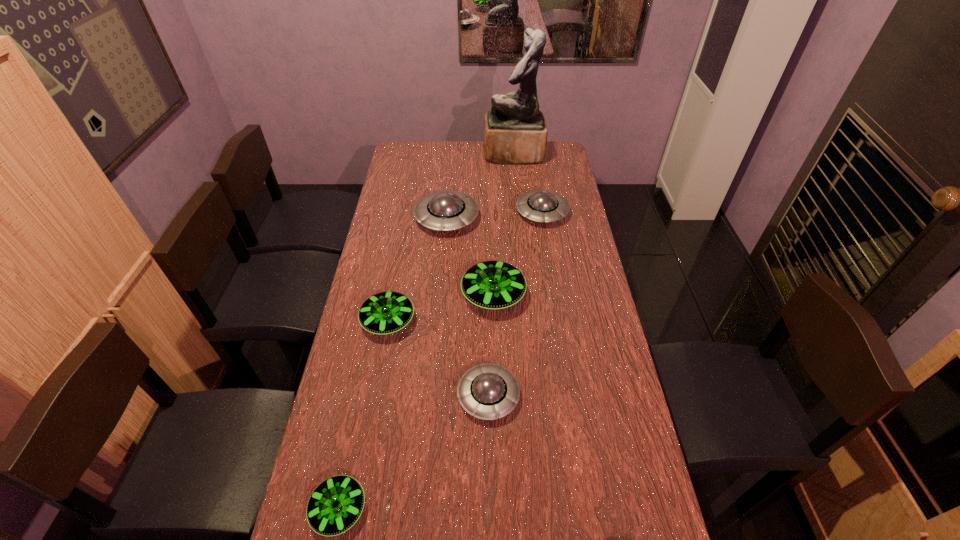
Identify the location of vacant space at the far edge of the desktop. The height and width of the screenshot is (540, 960). (446, 154).

At what (x,y) coordinates should I click in order to perform the action: click on free spot at the left edge of the desktop. Please return your answer as a coordinate pair (x, y). Image resolution: width=960 pixels, height=540 pixels. Looking at the image, I should click on coord(392,206).

You are a GUI agent. You are given a task and a screenshot of the screen. Output one action in this format:
    pyautogui.click(x=<x>, y=<y>)
    Task: Click on the vacant space at the right edge of the desktop
    Image resolution: width=960 pixels, height=540 pixels.
    Given the screenshot: What is the action you would take?
    pos(560,175)

Find the location of a particular element. The width and height of the screenshot is (960, 540). vacant space at the far left corner is located at coordinates (403, 156).

Where is `vacant space at the far right corner`? Image resolution: width=960 pixels, height=540 pixels. vacant space at the far right corner is located at coordinates 549,145.

Where is `vacant region between the second smallest green saucer and the biggest gray saucer`? Image resolution: width=960 pixels, height=540 pixels. vacant region between the second smallest green saucer and the biggest gray saucer is located at coordinates (418, 269).

Locate an element on the screen. Image resolution: width=960 pixels, height=540 pixels. free space that is in between the sculpture and the biggest gray saucer is located at coordinates (480, 186).

Locate an element on the screen. This screenshot has width=960, height=540. free point between the second nearest saucer and the rightmost gray saucer is located at coordinates (516, 304).

The width and height of the screenshot is (960, 540). I want to click on free space between the second smallest green saucer and the biggest gray saucer, so click(x=418, y=269).

Select which object is the fourth closest to the second nearest saucer. Please provide its 2D coordinates. Your answer should be formatted as a tuple, i.e. [(x, y)], where the tuple contains the x and y coordinates of a point satisfying the conditions above.

[(446, 210)]